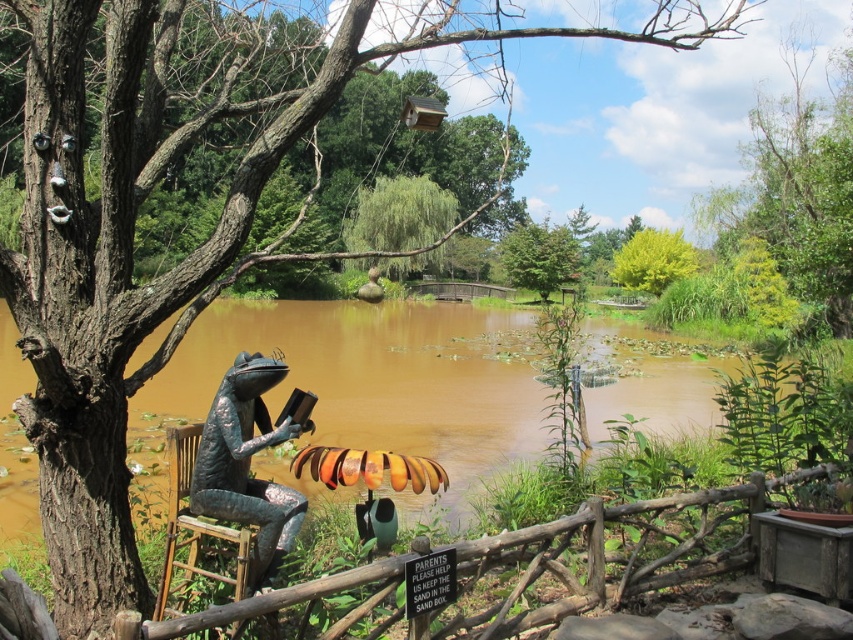
Question: Which object is positioned farthest from the shiny bronze frog at center?

Choices:
 (A) yellow-green leafy tree at upper right
 (B) green leafy tree at upper center

Answer: (A)

Question: Observing the image, what is the correct spatial positioning of shiny bronze frog at center in reference to green leafy tree at center?

Choices:
 (A) left
 (B) right

Answer: (A)

Question: Which point is closer to the camera?

Choices:
 (A) green leafy tree at upper center
 (B) shiny bronze frog at center

Answer: (B)

Question: Is shiny bronze frog at center above yellow-green leafy tree at upper right?

Choices:
 (A) no
 (B) yes

Answer: (A)

Question: Which object appears closest to the camera in this image?

Choices:
 (A) yellow-green leafy tree at upper right
 (B) green leafy tree at upper center
 (C) shiny bronze frog at center
 (D) green leafy tree at center

Answer: (C)

Question: Observing the image, what is the correct spatial positioning of shiny bronze frog at center in reference to yellow-green leafy tree at upper right?

Choices:
 (A) above
 (B) below

Answer: (B)